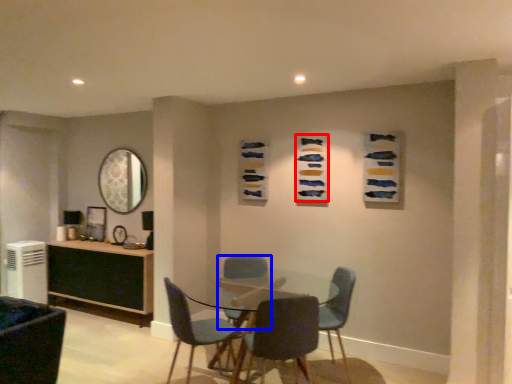
Question: Which point is closer to the camera, art (highlighted by a red box) or chair (highlighted by a blue box)?

Choices:
 (A) art
 (B) chair

Answer: (B)